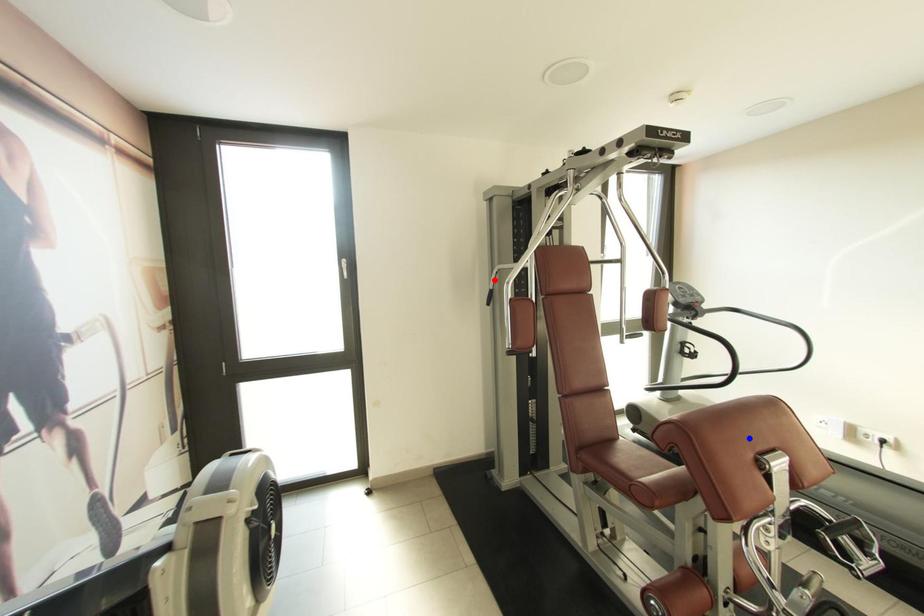
Question: In the image, two points are highlighted. Which point is nearer to the camera? Reply with the corresponding letter.

Choices:
 (A) blue point
 (B) red point

Answer: (A)